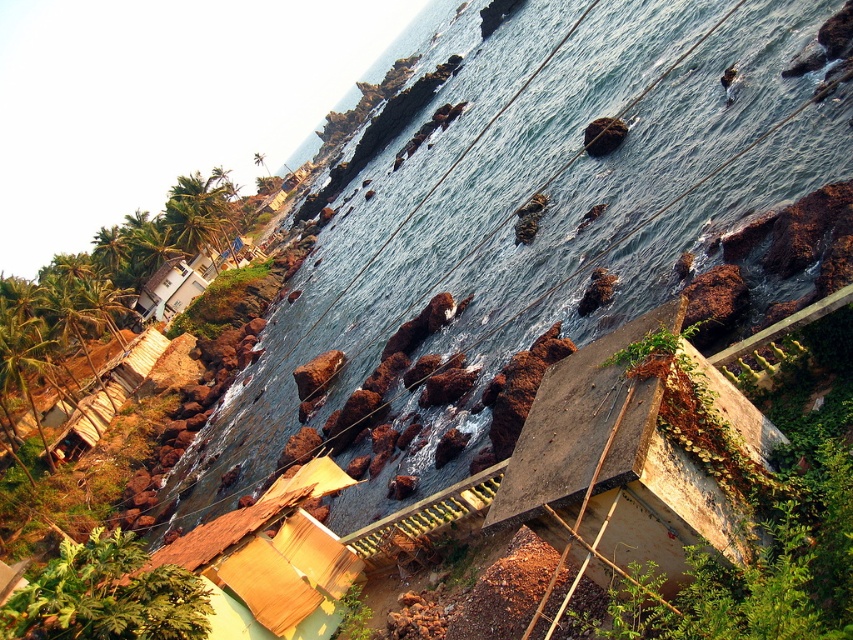
You are a photographer setting up a tripod to capture the coastal scene. You want to ensure that both the brown woven mat at lower left and the white matte house at upper left are visible in your shot. Given their relative sizes in the image, which object will appear smaller in the final photograph?

The brown woven mat at lower left appears smaller in the final photograph because it is shorter than the white matte house at upper left.

From the picture: You are a delivery person standing at the brown woven mat at lower left, and you need to deliver a package to the blue water at center. The delivery vehicle can only travel on solid ground and has a maximum range of 100 feet. Can you complete the delivery without needing to refuel?

The distance between the brown woven mat at lower left and the blue water at center is 98.18 feet, which is within the delivery vehicle maximum range of 100 feet. Therefore, the delivery can be completed without needing to refuel.